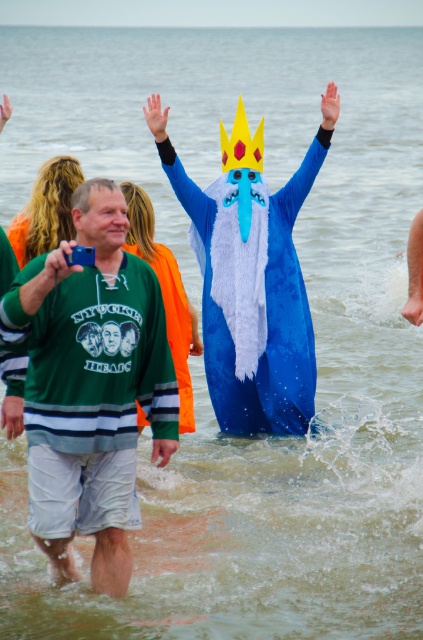
Is green jersey at center shorter than fuzzy blue costume at center?

No.

This screenshot has height=640, width=423. What do you see at coordinates (90, 385) in the screenshot?
I see `green jersey at center` at bounding box center [90, 385].

Who is more distant from viewer, (145, 337) or (165, 321)?

Positioned behind is point (165, 321).

This screenshot has height=640, width=423. In order to click on green jersey at center in this screenshot , I will do `click(90, 385)`.

Which of these two, blue plush costume at center or fuzzy blue costume at center, stands shorter?

Standing shorter between the two is fuzzy blue costume at center.

Is blue plush costume at center above fuzzy blue costume at center?

Correct, blue plush costume at center is located above fuzzy blue costume at center.

Where is `blue plush costume at center`? The width and height of the screenshot is (423, 640). blue plush costume at center is located at coordinates (252, 292).

You are a GUI agent. You are given a task and a screenshot of the screen. Output one action in this format:
    pyautogui.click(x=<x>, y=<y>)
    Task: Click on the blue plush costume at center
    
    Given the screenshot: What is the action you would take?
    pyautogui.click(x=252, y=292)

Can you confirm if green jersey at center is shorter than yellow paper crown at center?

No, green jersey at center is not shorter than yellow paper crown at center.

Is green jersey at center wider than yellow paper crown at center?

Correct, the width of green jersey at center exceeds that of yellow paper crown at center.

You are a GUI agent. You are given a task and a screenshot of the screen. Output one action in this format:
    pyautogui.click(x=<x>, y=<y>)
    Task: Click on the green jersey at center
    The width and height of the screenshot is (423, 640).
    Given the screenshot: What is the action you would take?
    (x=90, y=385)